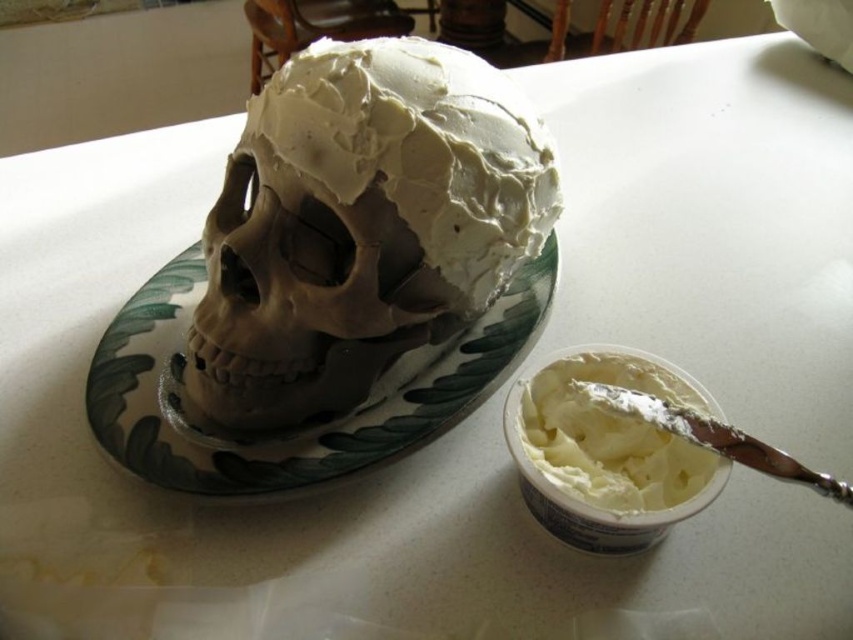
Is matte clay skull at center taller than white creamy frosting at lower right?

Indeed, matte clay skull at center has a greater height compared to white creamy frosting at lower right.

Between point (228, 355) and point (608, 378), which one is positioned behind?

Positioned behind is point (608, 378).

Does point (381, 77) lie behind point (706, 458)?

Yes, it is behind point (706, 458).

This screenshot has width=853, height=640. I want to click on matte clay skull at center, so click(x=360, y=225).

Can you confirm if green leafy platter at center is shorter than white creamy frosting at lower right?

In fact, green leafy platter at center may be taller than white creamy frosting at lower right.

Does green leafy platter at center have a greater height compared to white creamy frosting at lower right?

Correct, green leafy platter at center is much taller as white creamy frosting at lower right.

This screenshot has height=640, width=853. Find the location of `green leafy platter at center`. green leafy platter at center is located at coordinates (312, 426).

Can you confirm if matte clay skull at center is smaller than green leafy platter at center?

Yes, matte clay skull at center is smaller than green leafy platter at center.

Between matte clay skull at center and green leafy platter at center, which one is positioned higher?

matte clay skull at center

Find the location of a particular element. matte clay skull at center is located at coordinates (360, 225).